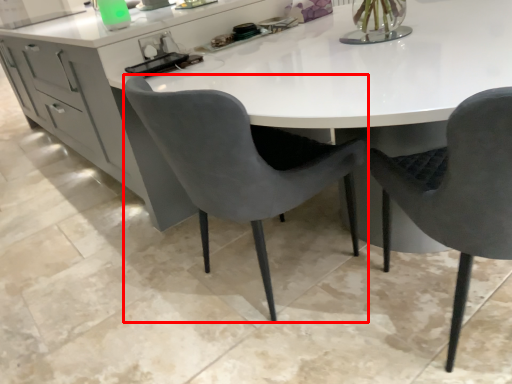
Question: From the image's perspective, what is the correct spatial relationship of chair (annotated by the red box) in relation to chair?

Choices:
 (A) below
 (B) above

Answer: (B)